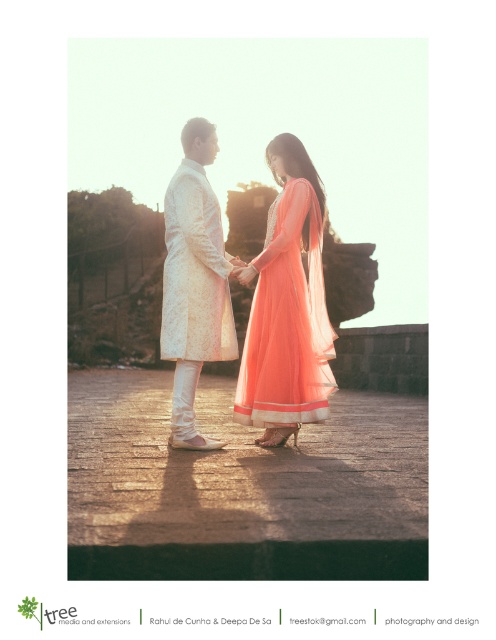
Question: Which is nearer to the white textured sherwani at center?

Choices:
 (A) matte peach gown at center
 (B) matte white sherwani at center

Answer: (B)

Question: Considering the relative positions of matte white sherwani at center and white textured sherwani at center in the image provided, where is matte white sherwani at center located with respect to white textured sherwani at center?

Choices:
 (A) below
 (B) above

Answer: (A)

Question: Which of the following is the closest to the observer?

Choices:
 (A) (260, 332)
 (B) (204, 356)
 (C) (276, 408)

Answer: (C)

Question: Which of the following is the closest to the observer?

Choices:
 (A) white textured sherwani at center
 (B) matte peach gown at center
 (C) matte white sherwani at center

Answer: (C)

Question: Can you confirm if matte peach gown at center is thinner than white textured sherwani at center?

Choices:
 (A) yes
 (B) no

Answer: (B)

Question: Is matte white sherwani at center to the left of white textured sherwani at center from the viewer's perspective?

Choices:
 (A) yes
 (B) no

Answer: (B)